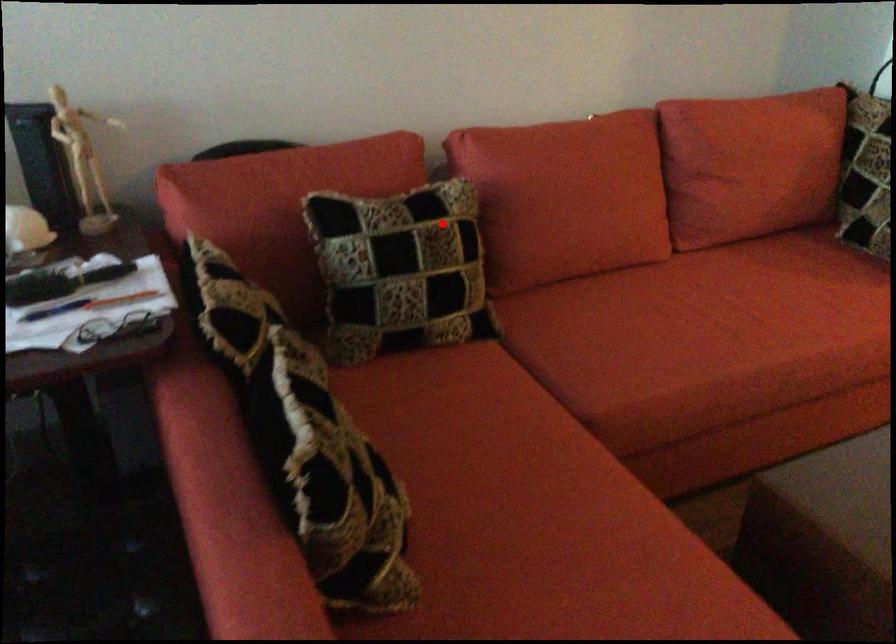
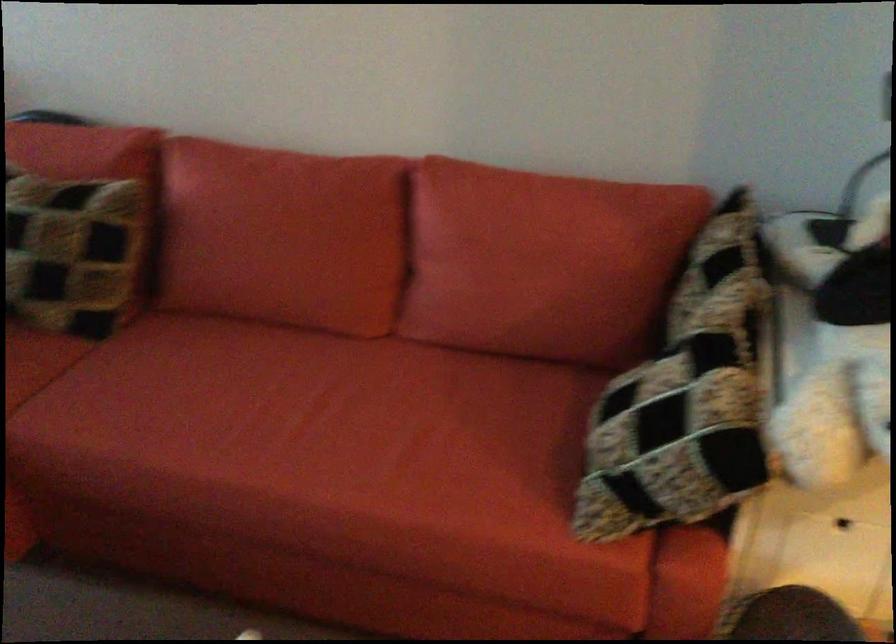
In the second image, find the point that corresponds to the highlighted location in the first image.

(76, 223)